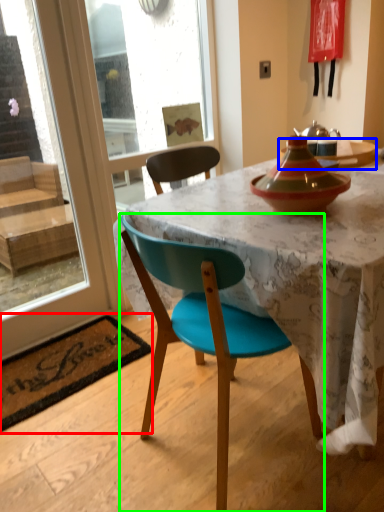
Question: Considering the real-world distances, which object is closest to place mat (highlighted by a red box)? kitchen & dining room table (highlighted by a blue box) or chair (highlighted by a green box).

Choices:
 (A) kitchen & dining room table
 (B) chair

Answer: (B)